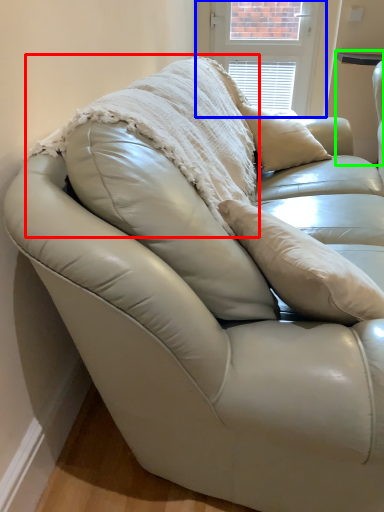
Question: Which is farther away from blanket (highlighted by a red box)? window screen (highlighted by a blue box) or table (highlighted by a green box)?

Choices:
 (A) window screen
 (B) table

Answer: (B)